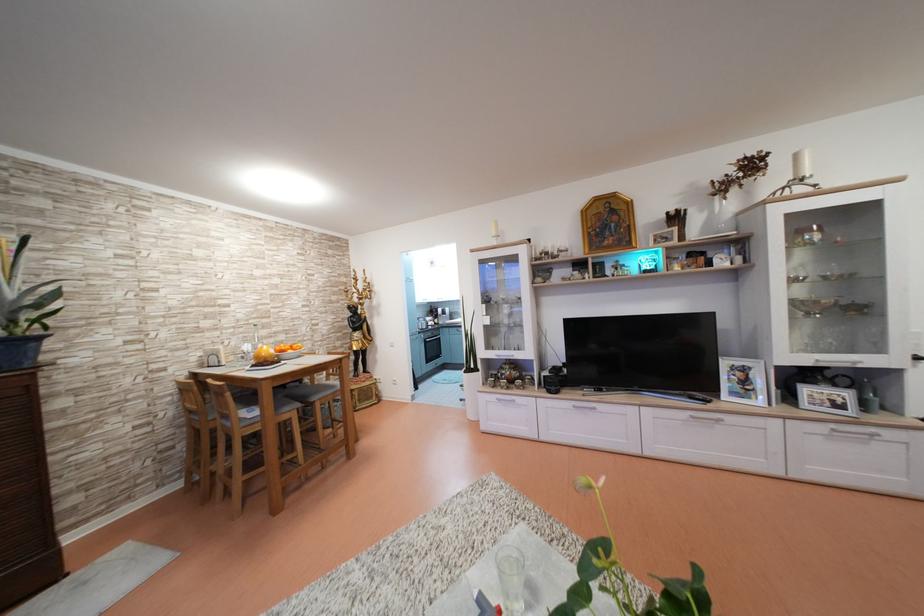
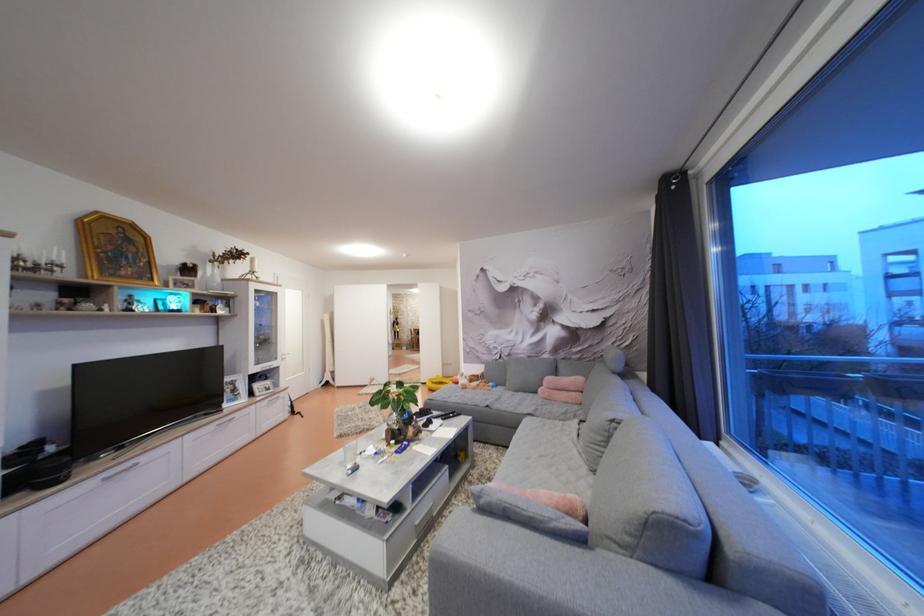
In the second image, find the point that corresponds to the point at 845,411 in the first image.

(274, 394)